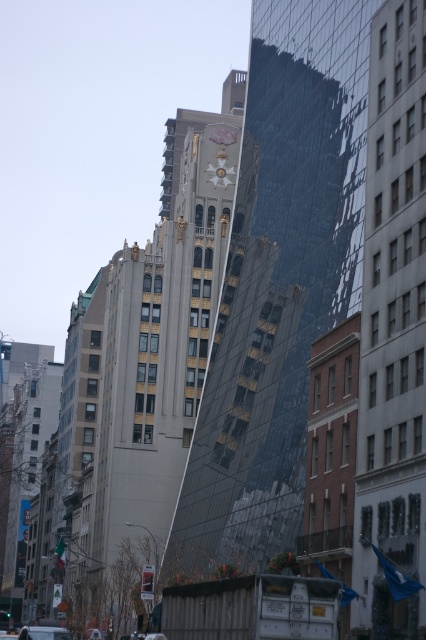
Is reflective glass skyscraper at center closer to camera compared to white matte car at lower left?

Yes, it is.

Which is below, reflective glass skyscraper at center or white matte car at lower left?

white matte car at lower left

Locate an element on the screen. The image size is (426, 640). reflective glass skyscraper at center is located at coordinates (393, 332).

Which is in front, point (288, 243) or point (66, 637)?

Point (66, 637)

What do you see at coordinates (278, 282) in the screenshot?
I see `gold ornate tower at center` at bounding box center [278, 282].

This screenshot has height=640, width=426. Describe the element at coordinates (278, 282) in the screenshot. I see `gold ornate tower at center` at that location.

Find the location of `gold ornate tower at center`. gold ornate tower at center is located at coordinates (278, 282).

Who is higher up, white matte car at lower left or gold metallic clock at upper center?

gold metallic clock at upper center

Can you confirm if white matte car at lower left is positioned to the left of gold metallic clock at upper center?

Correct, you'll find white matte car at lower left to the left of gold metallic clock at upper center.

Between point (51, 637) and point (221, 177), which one is positioned behind?

Point (221, 177)

You are a GUI agent. You are given a task and a screenshot of the screen. Output one action in this format:
    pyautogui.click(x=<x>, y=<y>)
    Task: Click on the white matte car at lower left
    Image resolution: width=426 pixels, height=640 pixels.
    Given the screenshot: What is the action you would take?
    pyautogui.click(x=43, y=632)